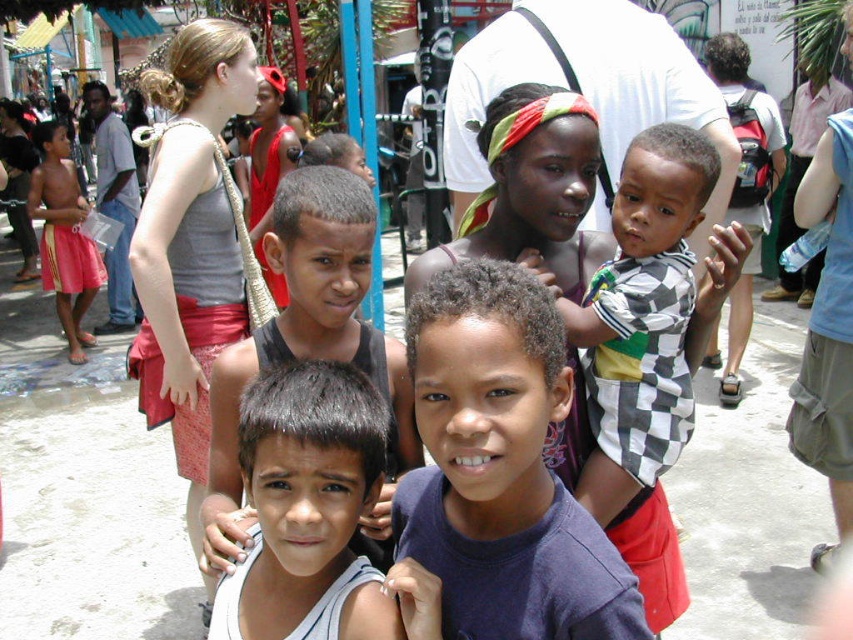
You are a photographer trying to capture a photo of both the purple cotton shirt at center and the checkered fabric shirt at center. Which shirt should you adjust your camera angle to focus on first if you want to capture them from left to right in the frame?

The purple cotton shirt at center is to the left of the checkered fabric shirt at center, so you should focus on the purple cotton shirt at center first when capturing them from left to right.

You are a tailor who needs to decide between two shirts for a client who prefers a looser fit. The client is looking at the purple cotton shirt at center and the checkered fabric shirt at center. Which shirt should you recommend?

The checkered fabric shirt at center is thicker than the purple cotton shirt at center, so the purple cotton shirt at center would provide a looser fit and should be recommended.